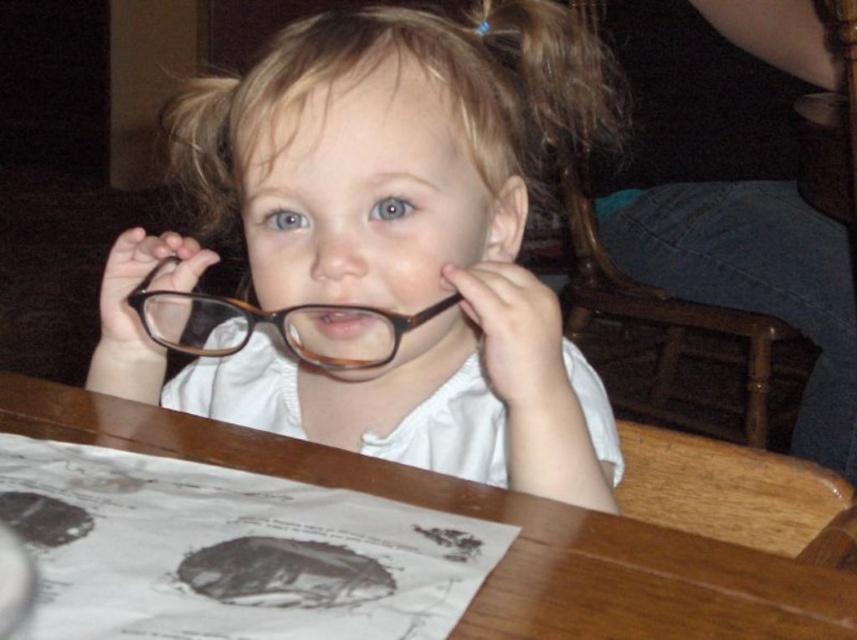
Describe the element at coordinates (387, 244) in the screenshot. I see `matte brown glasses at center` at that location.

Which is more to the right, matte brown glasses at center or wooden table at center?

Positioned to the right is matte brown glasses at center.

Which is in front, point (475, 172) or point (462, 621)?

Point (462, 621) is more forward.

Find the location of a particular element. This screenshot has height=640, width=857. matte brown glasses at center is located at coordinates (387, 244).

Who is positioned more to the left, wooden table at center or brown plastic glasses at center?

brown plastic glasses at center is more to the left.

Does wooden table at center lie in front of brown plastic glasses at center?

That is True.

At what (x,y) coordinates should I click in order to perform the action: click on wooden table at center. Please return your answer as a coordinate pair (x, y). The image size is (857, 640). Looking at the image, I should click on (499, 522).

I want to click on wooden table at center, so click(499, 522).

Who is positioned more to the right, matte brown glasses at center or brown plastic glasses at center?

Positioned to the right is matte brown glasses at center.

Consider the image. Between matte brown glasses at center and brown plastic glasses at center, which one is positioned lower?

brown plastic glasses at center

You are a GUI agent. You are given a task and a screenshot of the screen. Output one action in this format:
    pyautogui.click(x=<x>, y=<y>)
    Task: Click on the matte brown glasses at center
    The image size is (857, 640).
    Given the screenshot: What is the action you would take?
    pyautogui.click(x=387, y=244)